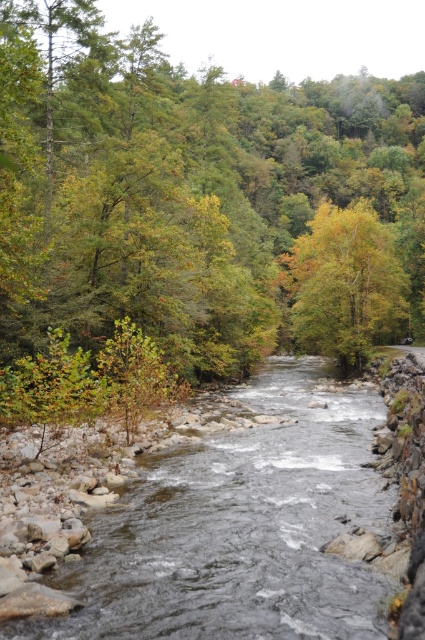
Consider the image. You are standing at the edge of the river and want to take a photo of the green leafy tree at upper center. If your camera has a maximum zoom range of 50 feet, will you be able to capture the tree clearly without moving closer?

The green leafy tree at upper center is 55.10 feet away from the viewer. Since the camera can only zoom up to 50 feet, you will not be able to capture the tree clearly without moving closer.